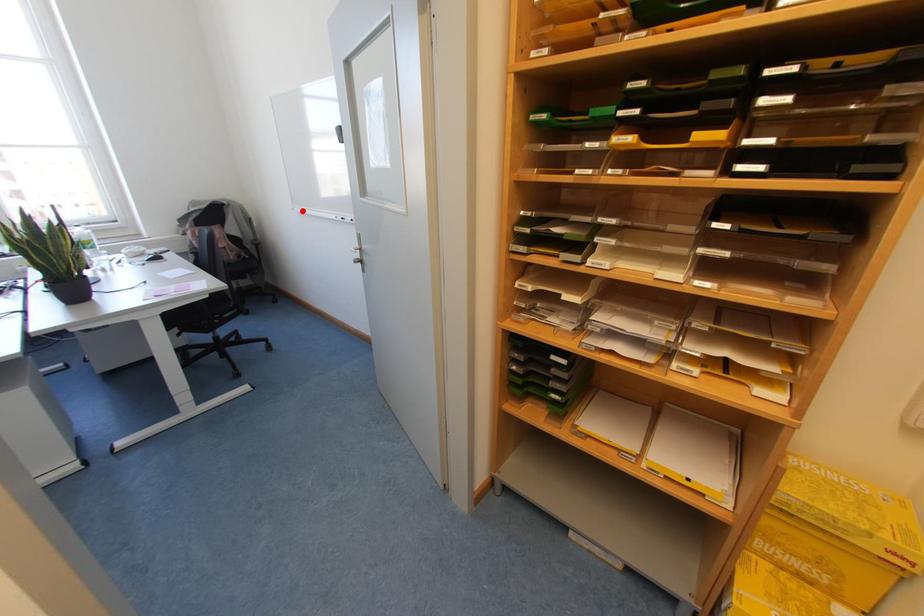
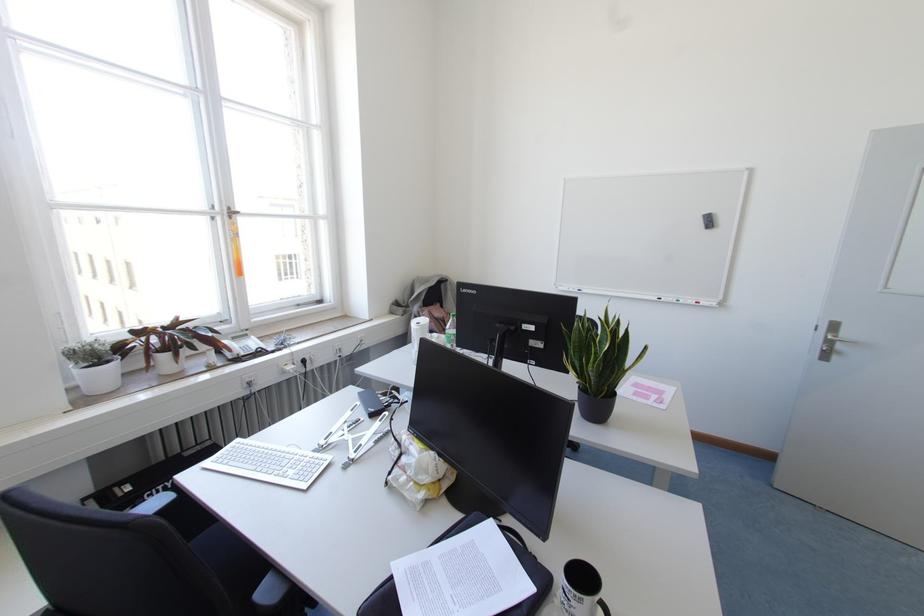
In the second image, find the point that corresponds to the highlighted location in the first image.

(578, 290)